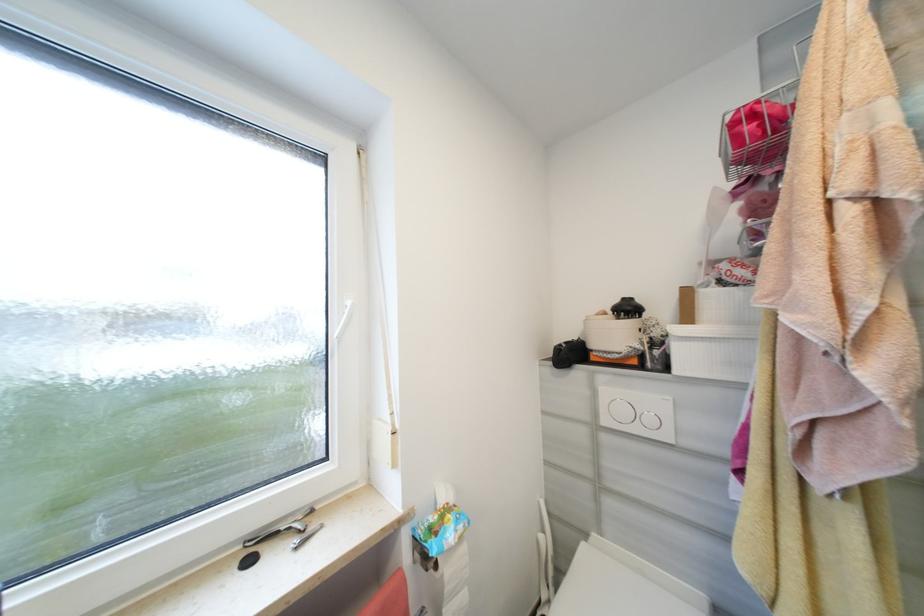
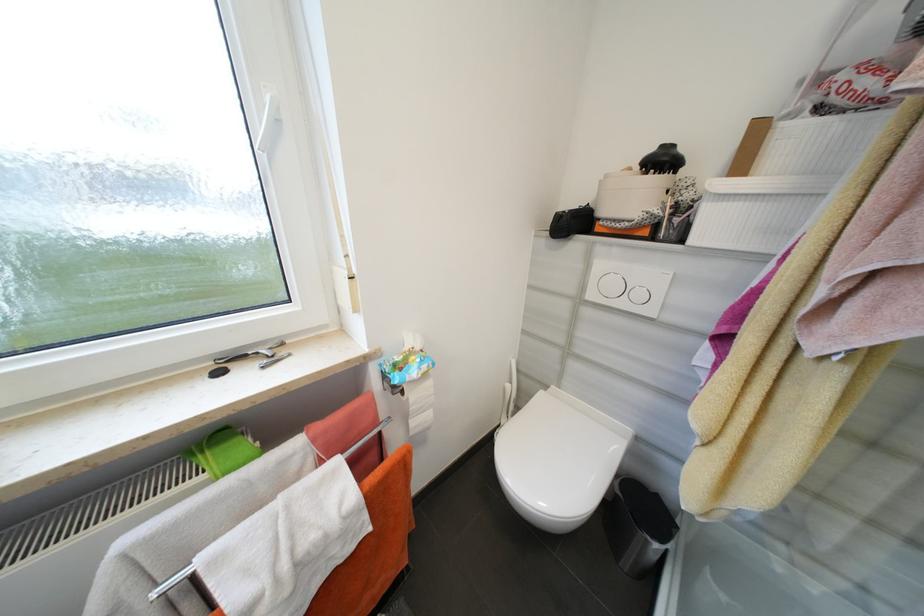
The point at (x=564, y=352) is marked in the first image. Where is the corresponding point in the second image?

(565, 217)